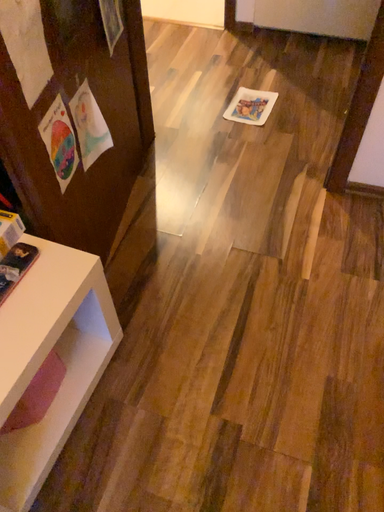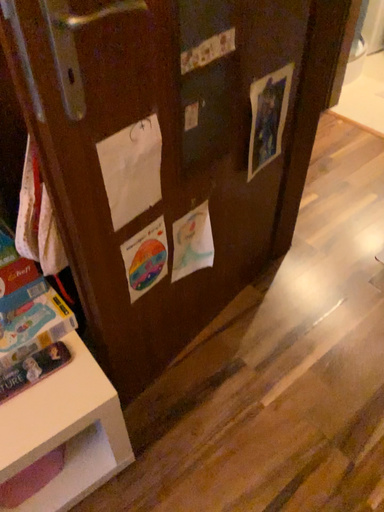
Question: Which way did the camera rotate in the video?

Choices:
 (A) rotated downward
 (B) rotated upward

Answer: (B)